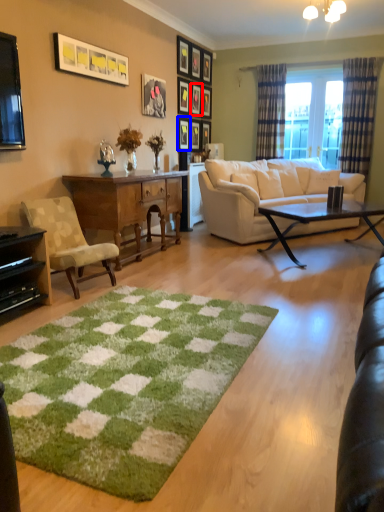
Question: Which point is further to the camera, picture frame (highlighted by a red box) or picture frame (highlighted by a blue box)?

Choices:
 (A) picture frame
 (B) picture frame

Answer: (A)